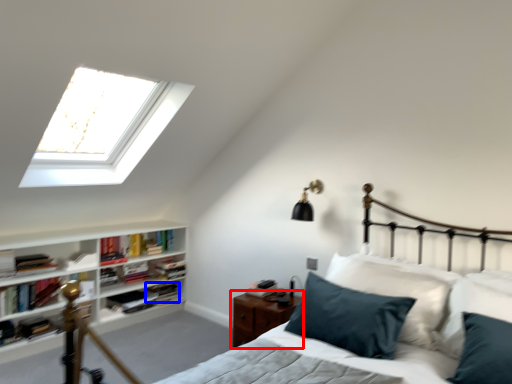
Question: Which object appears closest to the camera in this image, nightstand (highlighted by a red box) or book (highlighted by a blue box)?

Choices:
 (A) nightstand
 (B) book

Answer: (A)